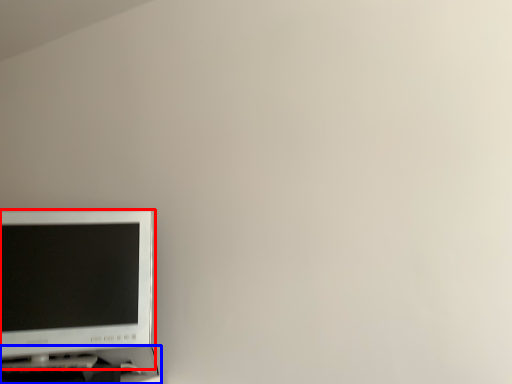
Question: Among these objects, which one is farthest to the camera, computer monitor (highlighted by a red box) or computer desk (highlighted by a blue box)?

Choices:
 (A) computer monitor
 (B) computer desk

Answer: (A)